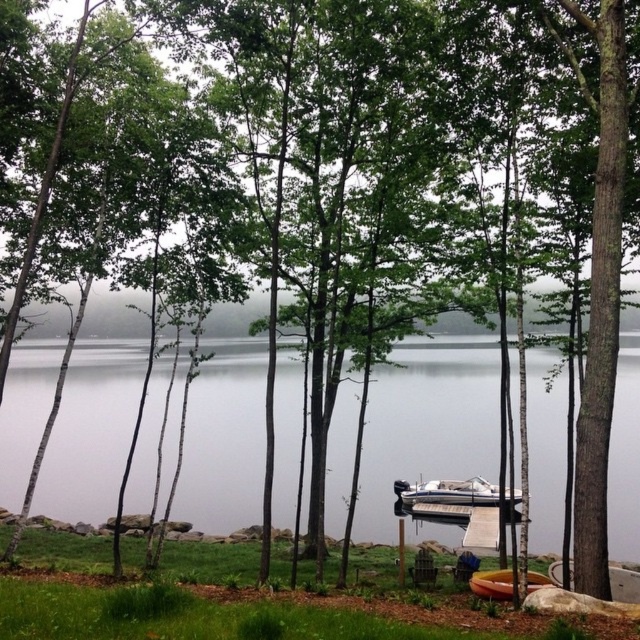
Is clear water at center shorter than white glossy boat at center?

No.

Can you confirm if clear water at center is wider than white glossy boat at center?

Yes, clear water at center is wider than white glossy boat at center.

You are a GUI agent. You are given a task and a screenshot of the screen. Output one action in this format:
    pyautogui.click(x=<x>, y=<y>)
    Task: Click on the clear water at center
    The height and width of the screenshot is (640, 640).
    Given the screenshot: What is the action you would take?
    pyautogui.click(x=428, y=422)

The width and height of the screenshot is (640, 640). I want to click on clear water at center, so [x=428, y=422].

Between white glossy boat at center and yellow plastic canoe at lower center, which one has more height?

With more height is yellow plastic canoe at lower center.

Who is positioned more to the left, white glossy boat at center or yellow plastic canoe at lower center?

yellow plastic canoe at lower center

The width and height of the screenshot is (640, 640). What do you see at coordinates (448, 492) in the screenshot? I see `white glossy boat at center` at bounding box center [448, 492].

The width and height of the screenshot is (640, 640). I want to click on white glossy boat at center, so click(x=448, y=492).

Measure the distance between clear water at center and yellow plastic canoe at lower center.

clear water at center and yellow plastic canoe at lower center are 7.53 meters apart from each other.

Looking at this image, between clear water at center and yellow plastic canoe at lower center, which one has more height?

clear water at center

Image resolution: width=640 pixels, height=640 pixels. I want to click on clear water at center, so click(428, 422).

Locate an element on the screen. The image size is (640, 640). clear water at center is located at coordinates (428, 422).